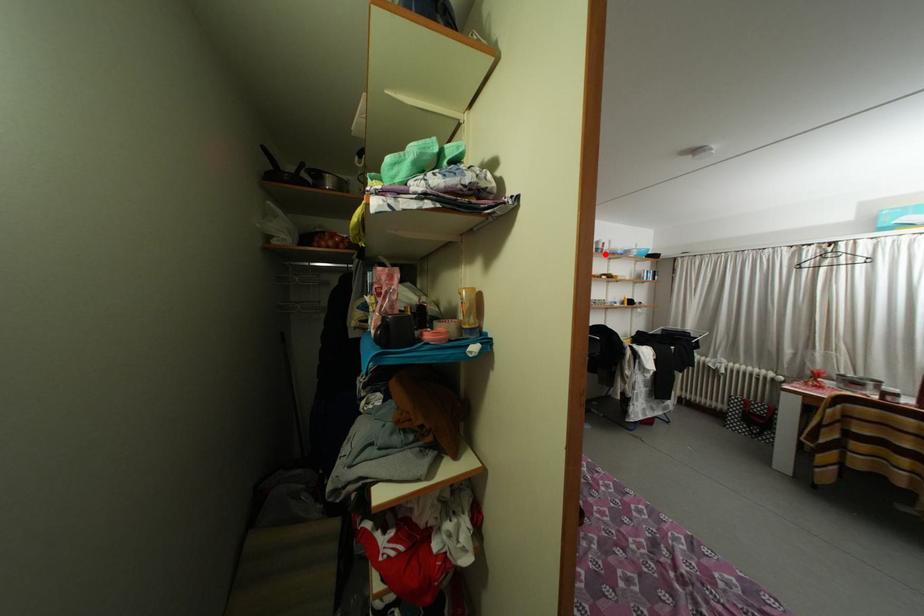
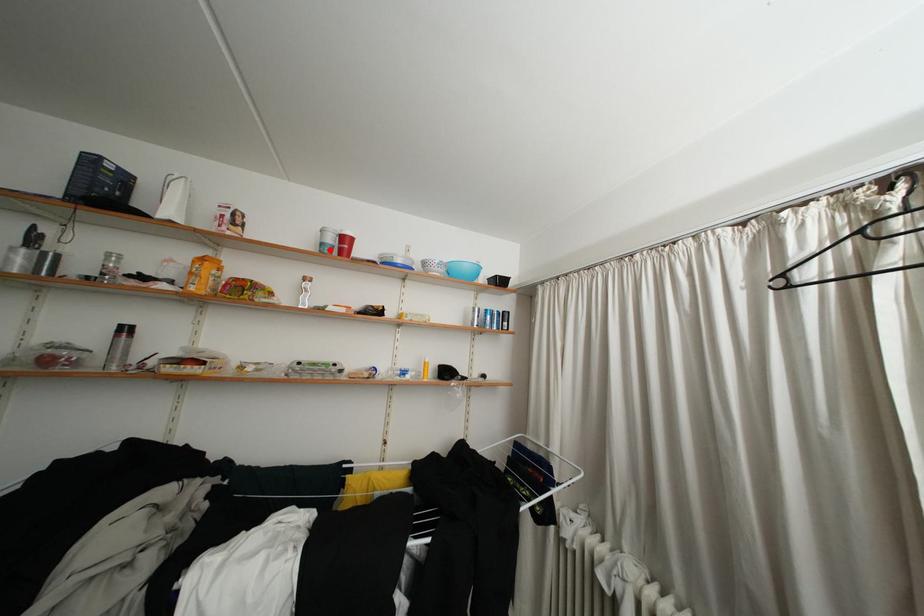
I am providing you with two images of the same scene from different viewpoints. A red point is marked on the first image and another point is marked on the second image. Is the red point in image1 aligned with the point shown in image2?

Yes